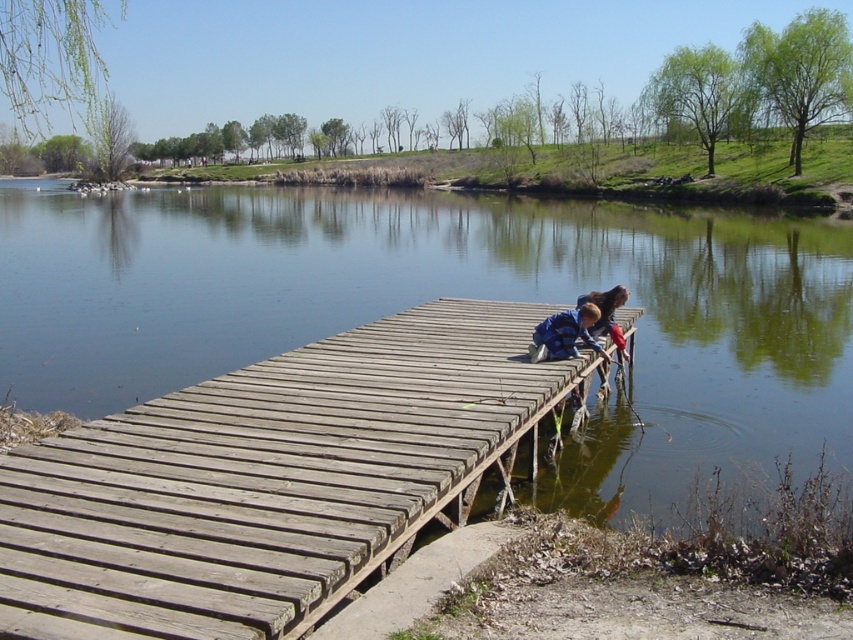
You are standing at the camera position and want to reach point (293, 592). Is the distance more than 10 feet?

The distance between the camera and point (293, 592) is 11.27 feet, which is more than 10 feet.

In the scene shown: You are standing at the edge of the wooden dock at center. If you walk straight ahead, will you step into the water or stay on the dock?

Since the wooden dock at center extends into the water, walking straight ahead from the edge would lead you further onto the dock until reaching the end, after which you would step into the water.